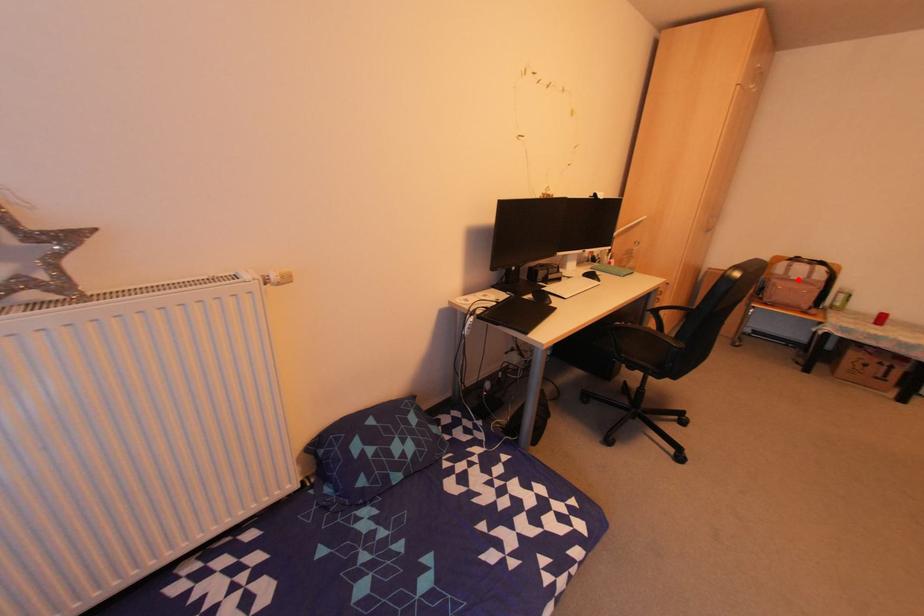
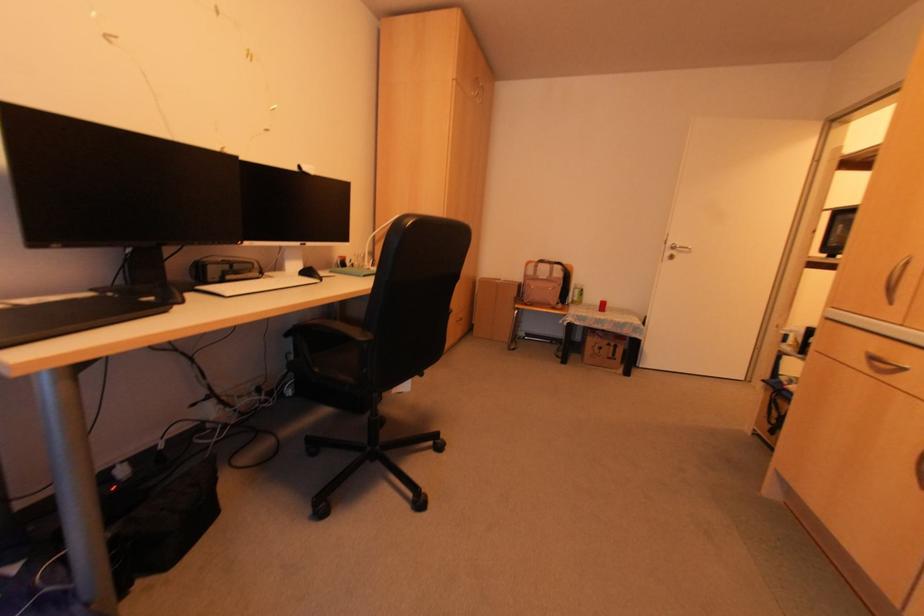
Question: I am providing you with two images of the same scene from different viewpoints. A red point is shown in image1. For the corresponding object point in image2, is it positioned nearer or farther from the camera?

Choices:
 (A) Nearer
 (B) Farther

Answer: (A)